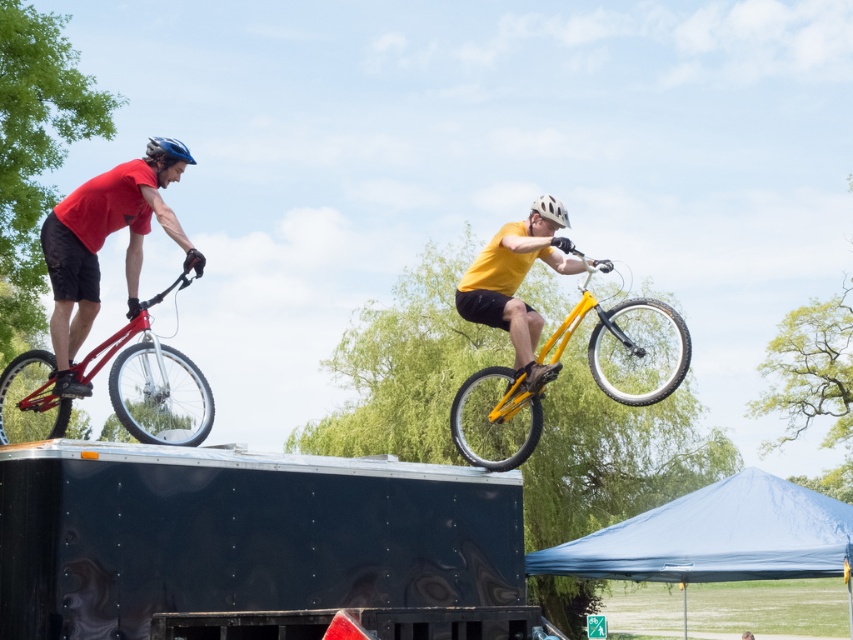
Does matte black bicycle at left have a lesser height compared to matte blue helmet at upper left?

Yes, matte black bicycle at left is shorter than matte blue helmet at upper left.

Consider the image. Is matte black bicycle at left smaller than matte blue helmet at upper left?

Correct, matte black bicycle at left occupies less space than matte blue helmet at upper left.

The width and height of the screenshot is (853, 640). What do you see at coordinates (99, 246) in the screenshot?
I see `matte black bicycle at left` at bounding box center [99, 246].

At what (x,y) coordinates should I click in order to perform the action: click on matte black bicycle at left. Please return your answer as a coordinate pair (x, y). The height and width of the screenshot is (640, 853). Looking at the image, I should click on (99, 246).

Based on the photo, is shiny red bicycle at left wider than matte blue helmet at upper left?

Correct, the width of shiny red bicycle at left exceeds that of matte blue helmet at upper left.

Is shiny red bicycle at left shorter than matte blue helmet at upper left?

No.

This screenshot has width=853, height=640. In order to click on shiny red bicycle at left in this screenshot , I will do `click(154, 387)`.

Does yellow matte mountain bike at center have a greater height compared to matte black bicycle at left?

Indeed, yellow matte mountain bike at center has a greater height compared to matte black bicycle at left.

Is yellow matte mountain bike at center to the left of matte black bicycle at left from the viewer's perspective?

In fact, yellow matte mountain bike at center is to the right of matte black bicycle at left.

What do you see at coordinates (628, 346) in the screenshot?
I see `yellow matte mountain bike at center` at bounding box center [628, 346].

At what (x,y) coordinates should I click in order to perform the action: click on yellow matte mountain bike at center. Please return your answer as a coordinate pair (x, y). This screenshot has height=640, width=853. Looking at the image, I should click on (628, 346).